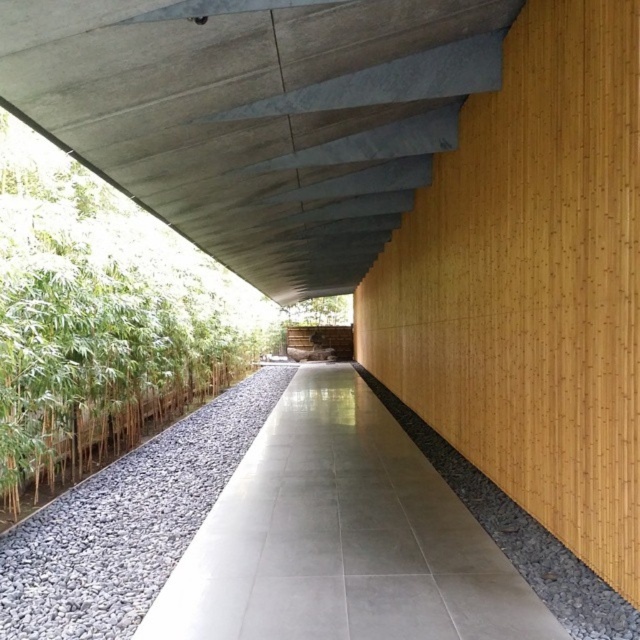
Locate an element on the screen. The height and width of the screenshot is (640, 640). gray gravel at center-left is located at coordinates (128, 522).

Who is more forward, [84,598] or [381,397]?

Positioned in front is point [84,598].

Is point (54, 506) farther from viewer compared to point (432, 456)?

No, (54, 506) is in front of (432, 456).

The height and width of the screenshot is (640, 640). What are the coordinates of `gray gravel at center-left` in the screenshot? It's located at (128, 522).

In order to click on gray concrete path at center in this screenshot , I will do `click(340, 538)`.

Which is above, gray concrete path at center or gray gravel at lower center?

gray gravel at lower center is above.

Is point (298, 637) less distant than point (436, 440)?

Yes, point (298, 637) is in front of point (436, 440).

You are a GUI agent. You are given a task and a screenshot of the screen. Output one action in this format:
    pyautogui.click(x=<x>, y=<y>)
    Task: Click on the gray concrete path at center
    Image resolution: width=640 pixels, height=640 pixels.
    Given the screenshot: What is the action you would take?
    340,538

Looking at this image, who is positioned more to the right, concrete ceiling at upper center or gray gravel at lower center?

Positioned to the right is gray gravel at lower center.

Does concrete ceiling at upper center appear on the left side of gray gravel at lower center?

Yes, concrete ceiling at upper center is to the left of gray gravel at lower center.

Is point (250, 209) closer to viewer compared to point (592, 620)?

No, it is not.

Identify the location of concrete ceiling at upper center. The image size is (640, 640). (257, 115).